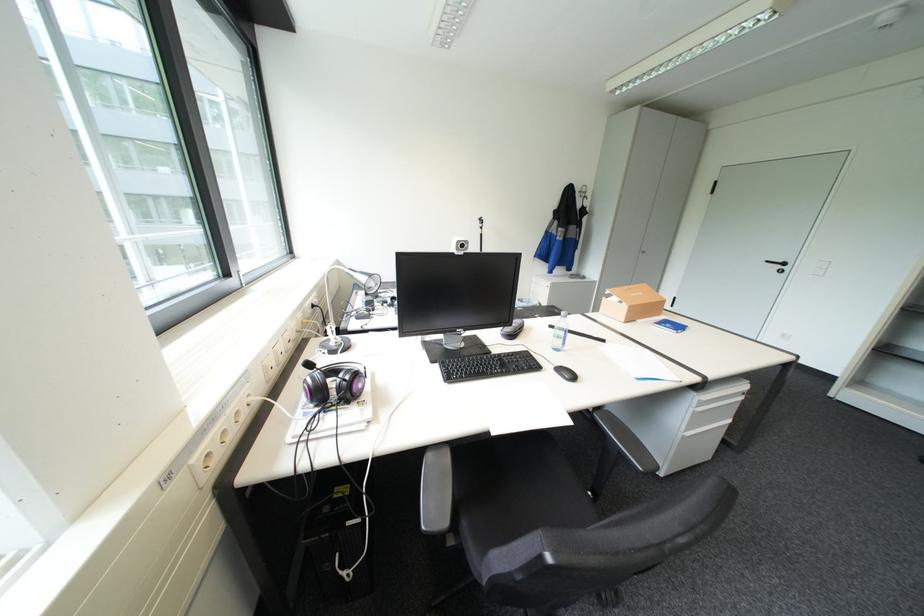
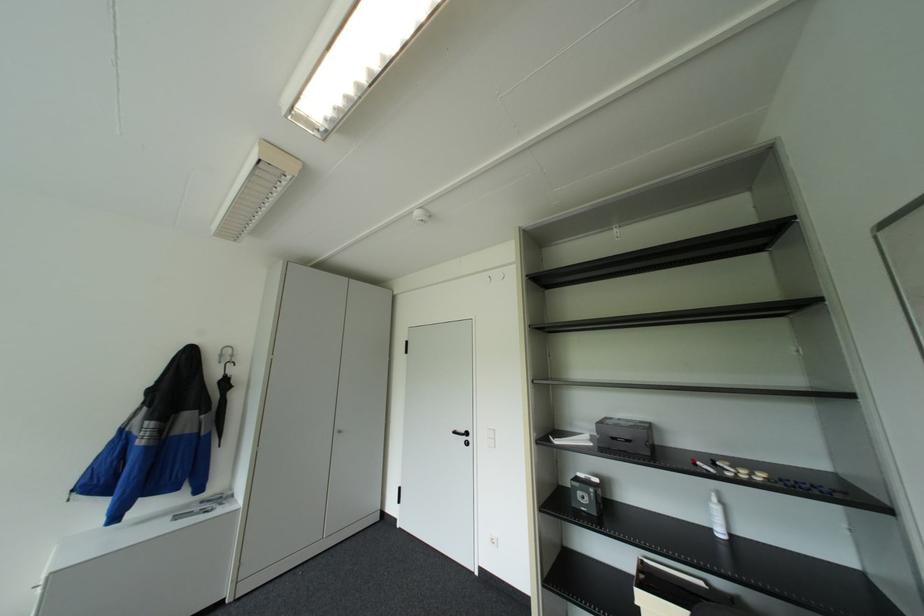
Locate, in the second image, the point that corresponds to [590,196] in the first image.

(227, 361)